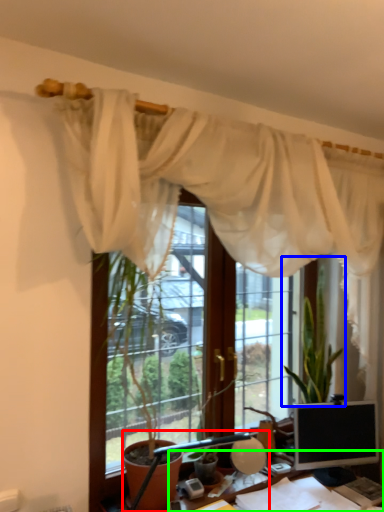
Question: Based on their relative distances, which object is farther from table lamp (highlighted by a red box)? Choose from houseplant (highlighted by a blue box) and desk (highlighted by a green box).

Choices:
 (A) houseplant
 (B) desk

Answer: (A)